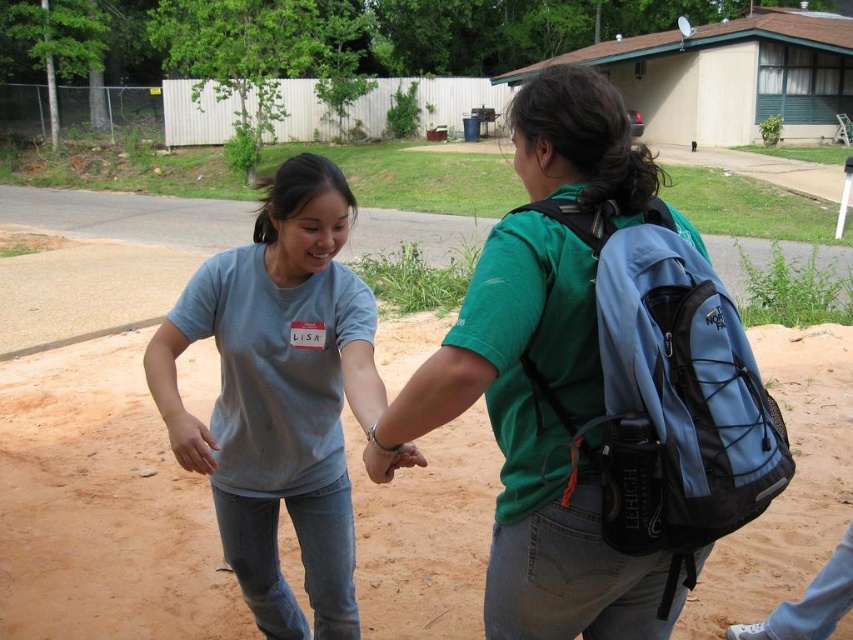
Question: Does brown sandy ground at lower center appear on the left side of matte gray t-shirt at center?

Choices:
 (A) no
 (B) yes

Answer: (B)

Question: Is blue fabric backpack at center to the right of matte gray t-shirt at center from the viewer's perspective?

Choices:
 (A) yes
 (B) no

Answer: (A)

Question: Does brown sandy ground at lower center appear over blue fabric backpack at right?

Choices:
 (A) no
 (B) yes

Answer: (A)

Question: Which point is farther from the camera taking this photo?

Choices:
 (A) (735, 481)
 (B) (299, 198)
 (C) (514, 321)

Answer: (B)

Question: Estimate the real-world distances between objects in this image. Which object is closer to the brown sandy ground at lower center?

Choices:
 (A) matte gray t-shirt at center
 (B) blue fabric backpack at right
 (C) blue fabric backpack at center

Answer: (A)

Question: Which object is the closest to the matte gray t-shirt at center?

Choices:
 (A) blue fabric backpack at right
 (B) blue fabric backpack at center
 (C) brown sandy ground at lower center

Answer: (B)